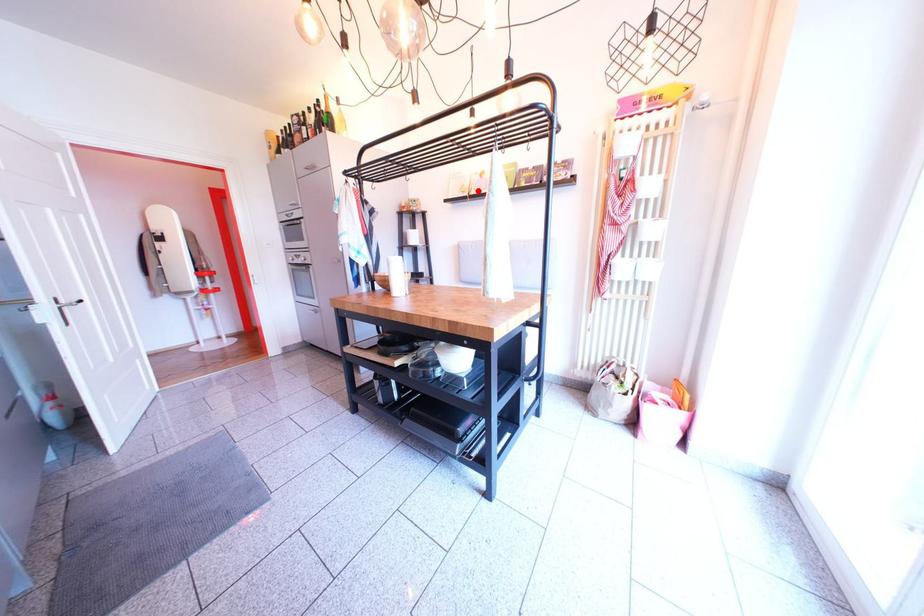
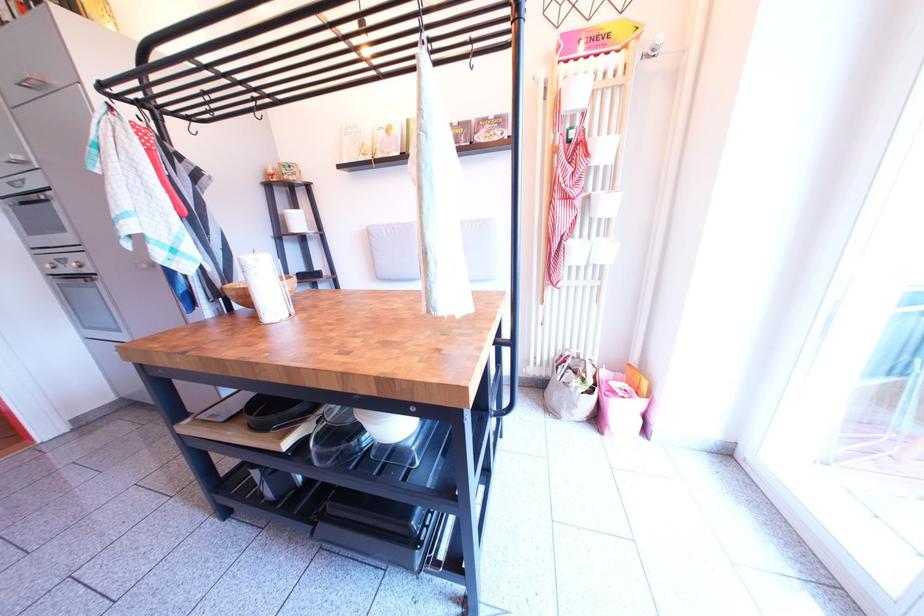
Question: I am providing you with two images of the same scene from different viewpoints. In image1, a red point is highlighted. Considering the same 3D point in image2, which of the following is correct?

Choices:
 (A) It is closer
 (B) It is farther

Answer: (B)